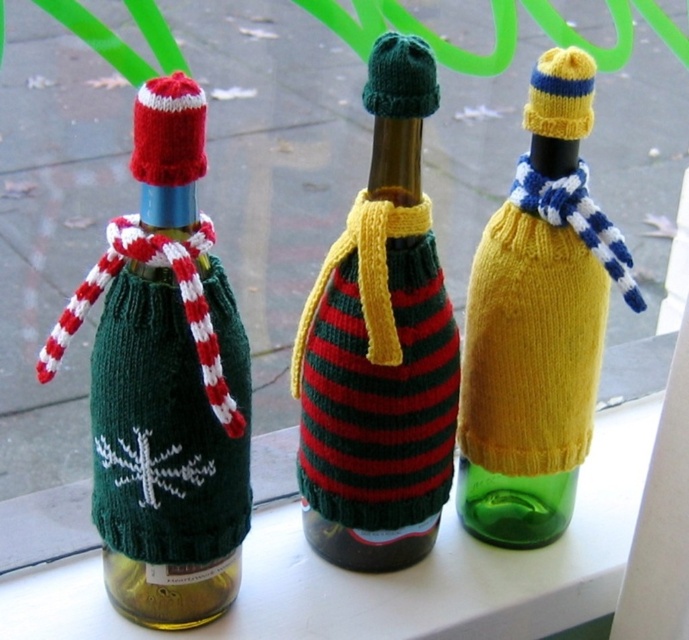
You are standing in front of the windowsill with three festive wine bottles. You need to place a new decoration exactly at the same position as the green knitted sweater at left. What are the coordinates where you should place the new decoration?

The coordinates for the green knitted sweater at left are at point (167, 448), so you should place the new decoration at those coordinates.

In the scene shown: You are a delivery person who needs to place a new bottle between the striped knit sweater at center and the green knitted sweater at left. The new bottle is 6 inches wide. Can you fit it between them?

The distance between the striped knit sweater at center and the green knitted sweater at left is 5.69 inches. Since the new bottle is 6 inches wide, it cannot fit between them as the space is narrower than the bottle.